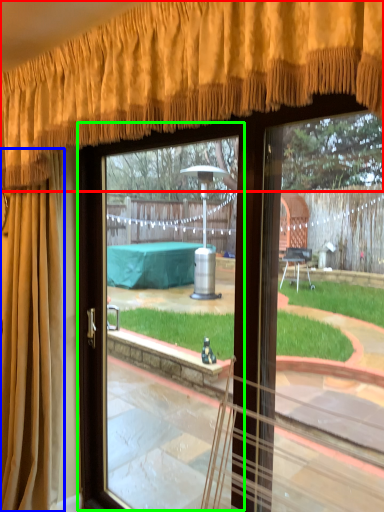
Question: Which object is positioned closest to curtain (highlighted by a red box)? Select from curtain (highlighted by a blue box) and screen door (highlighted by a green box).

Choices:
 (A) curtain
 (B) screen door

Answer: (A)